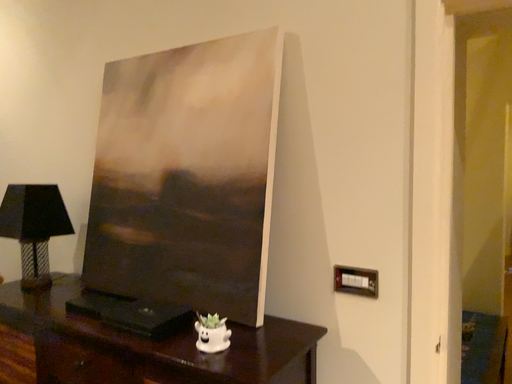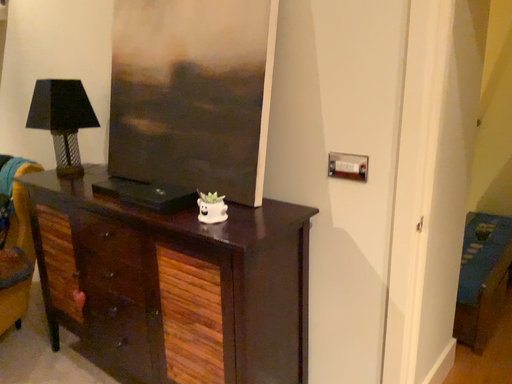
Question: How did the camera likely rotate when shooting the video?

Choices:
 (A) rotated upward
 (B) rotated downward

Answer: (B)